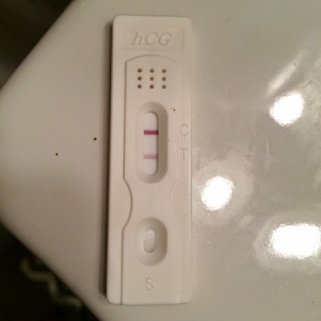
I want to click on carpet, so click(41, 301).